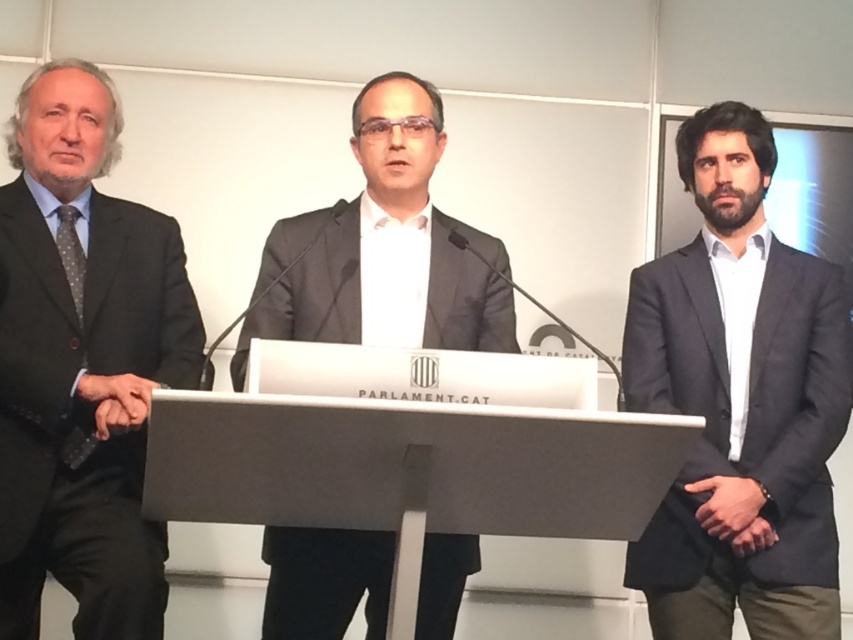
Question: Which of the following is the closest to the observer?

Choices:
 (A) (6, 266)
 (B) (322, 294)
 (C) (828, 544)
 (D) (660, 428)

Answer: (D)

Question: Estimate the real-world distances between objects in this image. Which object is closer to the matte gray suit at center?

Choices:
 (A) dark gray suit at right
 (B) black textured suit at left

Answer: (B)

Question: Estimate the real-world distances between objects in this image. Which object is closer to the black textured suit at left?

Choices:
 (A) white matte podium at center
 (B) matte gray suit at center

Answer: (B)

Question: Is dark gray suit at right above white matte podium at center?

Choices:
 (A) no
 (B) yes

Answer: (B)

Question: Observing the image, what is the correct spatial positioning of dark gray suit at right in reference to matte gray suit at center?

Choices:
 (A) above
 (B) below

Answer: (B)

Question: Can you confirm if black textured suit at left is positioned above white matte podium at center?

Choices:
 (A) yes
 (B) no

Answer: (A)